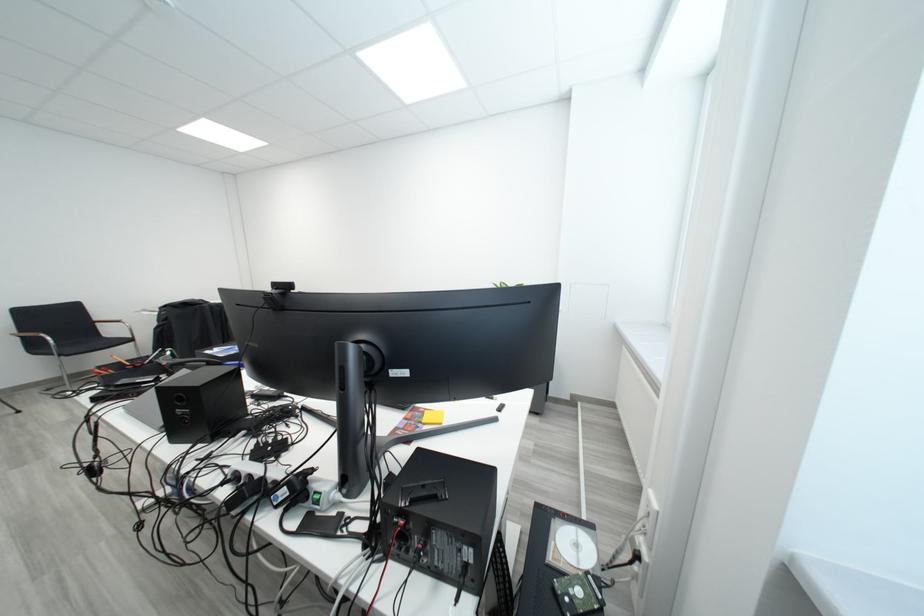
Image resolution: width=924 pixels, height=616 pixels. Identify the location of orange handled scissors. (142, 361).